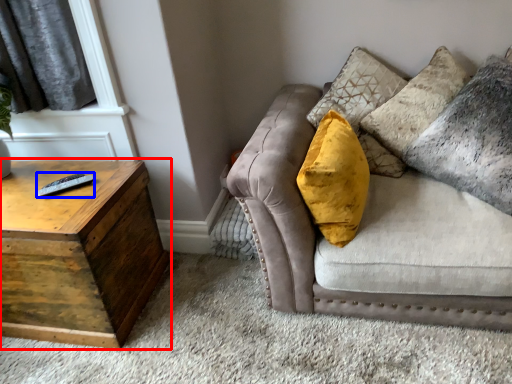
Question: Which of the following is the farthest to the observer, table (highlighted by a red box) or remote (highlighted by a blue box)?

Choices:
 (A) table
 (B) remote

Answer: (B)